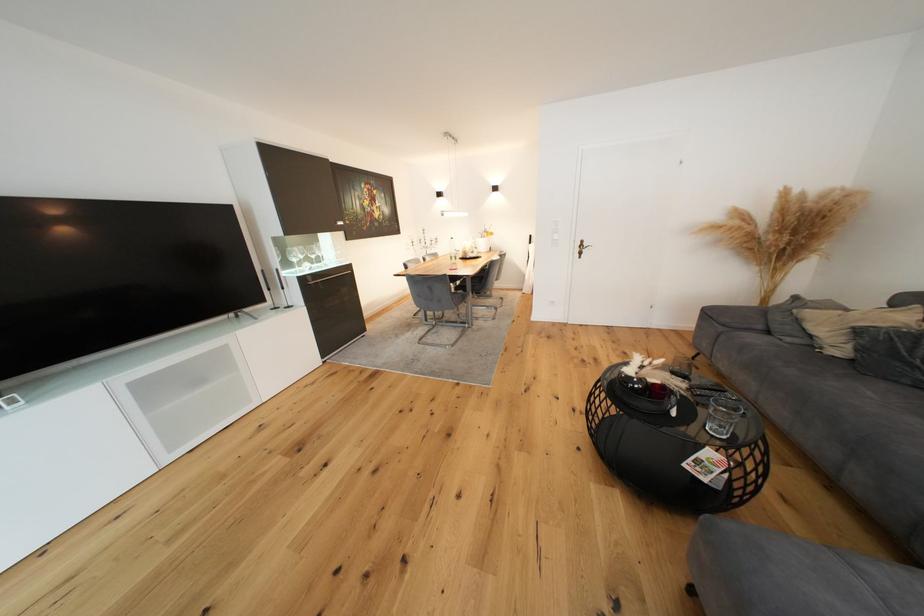
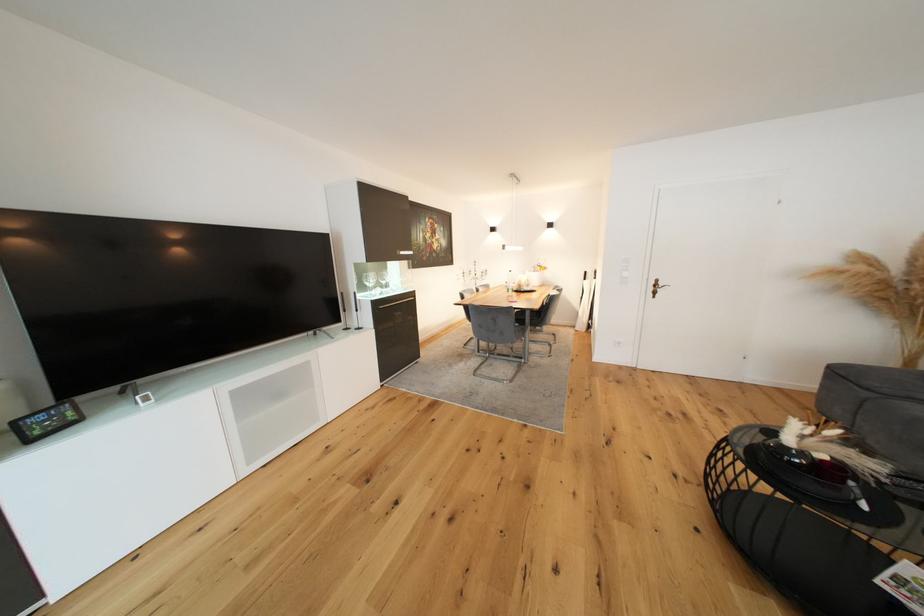
Question: Which direction would the cameraman need to move to produce the second image? Reply with the corresponding letter.

Choices:
 (A) Left
 (B) Right
 (C) Forward
 (D) Backward

Answer: (A)